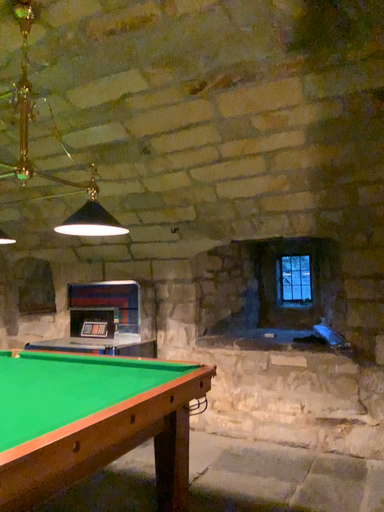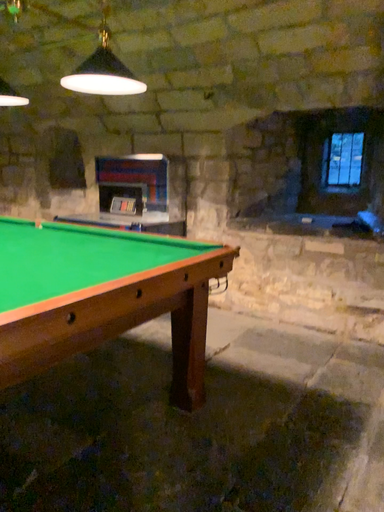
Question: Which way did the camera rotate in the video?

Choices:
 (A) rotated downward
 (B) rotated upward

Answer: (A)